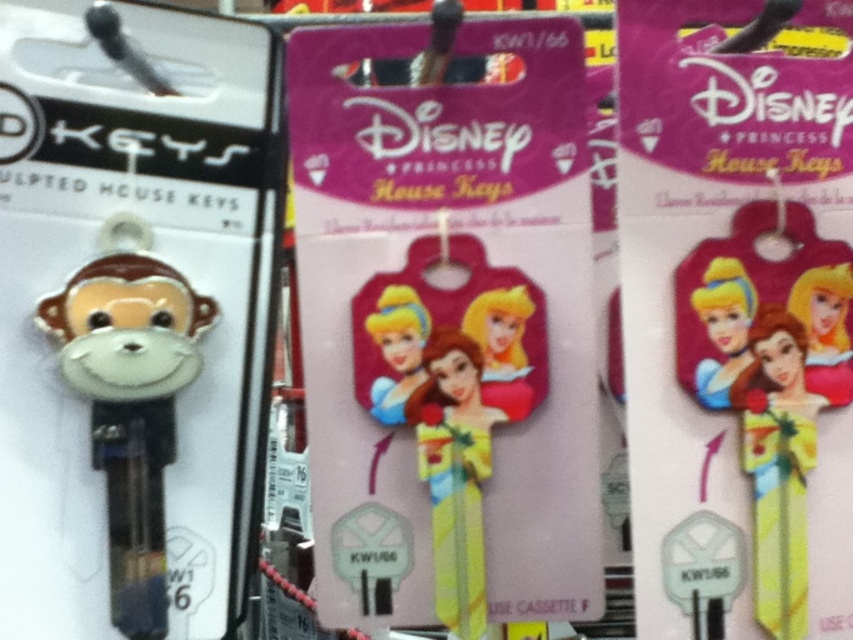
Consider the image. You are organizing a display of Disney keys and need to place the yellow matte doll at center and the glossy plastic cinderella at center on a shelf. Which key requires a wider space on the shelf?

The yellow matte doll at center requires a wider space on the shelf because its width is larger than the glossy plastic cinderella at center.

You are a customer at a Disney store and want to choose between the glossy plastic cinderella at center and the black plastic hook at upper left. Which one is narrower?

The glossy plastic cinderella at center has a lesser width compared to the black plastic hook at upper left, so it is narrower.

You are a customer at a Disney store. You see the glossy plastic cinderella at center and the black plastic hook at upper left. Which object is positioned higher in the image?

The black plastic hook at upper left is positioned higher than the glossy plastic cinderella at center.